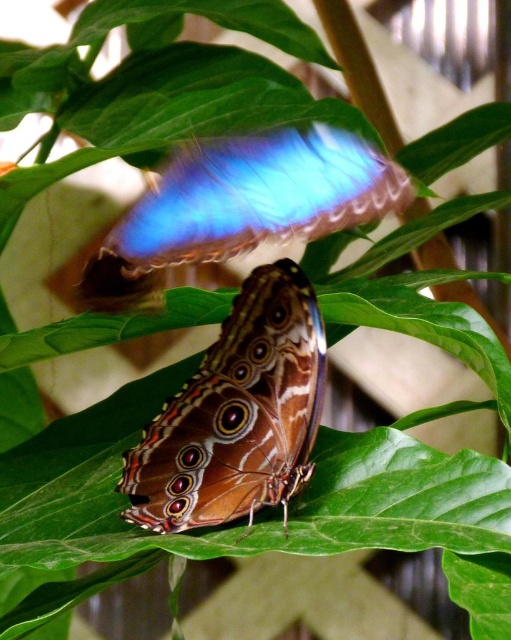
Question: Among these points, which one is farthest from the camera?

Choices:
 (A) (236, 237)
 (B) (211, 401)

Answer: (B)

Question: Can you confirm if brown textured butterfly at center is positioned above blue iridescent wing at upper center?

Choices:
 (A) no
 (B) yes

Answer: (A)

Question: From the image, what is the correct spatial relationship of brown textured butterfly at center in relation to blue iridescent wing at upper center?

Choices:
 (A) right
 (B) left

Answer: (A)

Question: Which of the following is the farthest from the observer?

Choices:
 (A) brown textured butterfly at center
 (B) blue iridescent wing at upper center

Answer: (A)

Question: Does brown textured butterfly at center have a smaller size compared to blue iridescent wing at upper center?

Choices:
 (A) yes
 (B) no

Answer: (A)